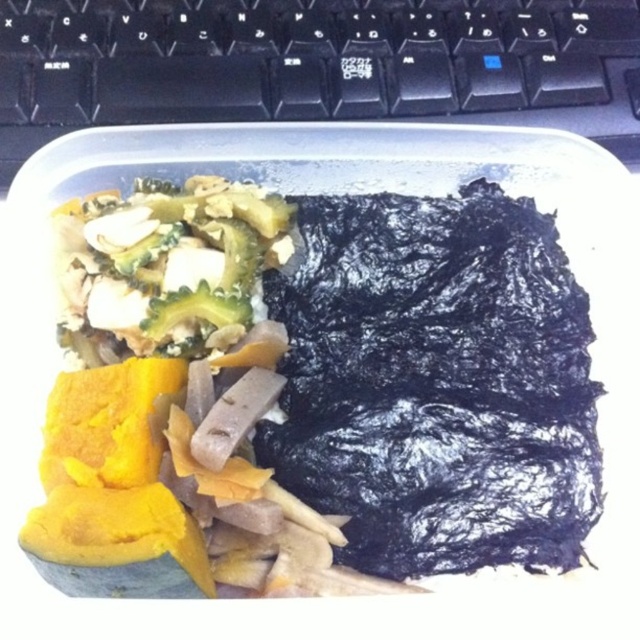
Can you confirm if dark purple seaweed at upper right is wider than black plastic keyboard at upper center?

Incorrect, dark purple seaweed at upper right's width does not surpass black plastic keyboard at upper center's.

Between dark purple seaweed at upper right and black plastic keyboard at upper center, which one appears on the left side from the viewer's perspective?

From the viewer's perspective, black plastic keyboard at upper center appears more on the left side.

Is point (204, 458) positioned in front of point (106, 20)?

Yes, point (204, 458) is closer to viewer.

Where is `dark purple seaweed at upper right`? dark purple seaweed at upper right is located at coordinates (316, 397).